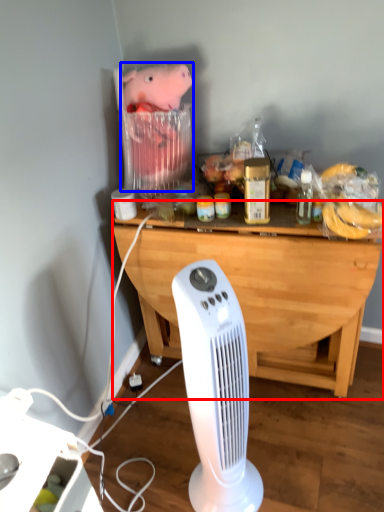
Question: Which object is further to the camera taking this photo, desk (highlighted by a red box) or animal (highlighted by a blue box)?

Choices:
 (A) desk
 (B) animal

Answer: (B)